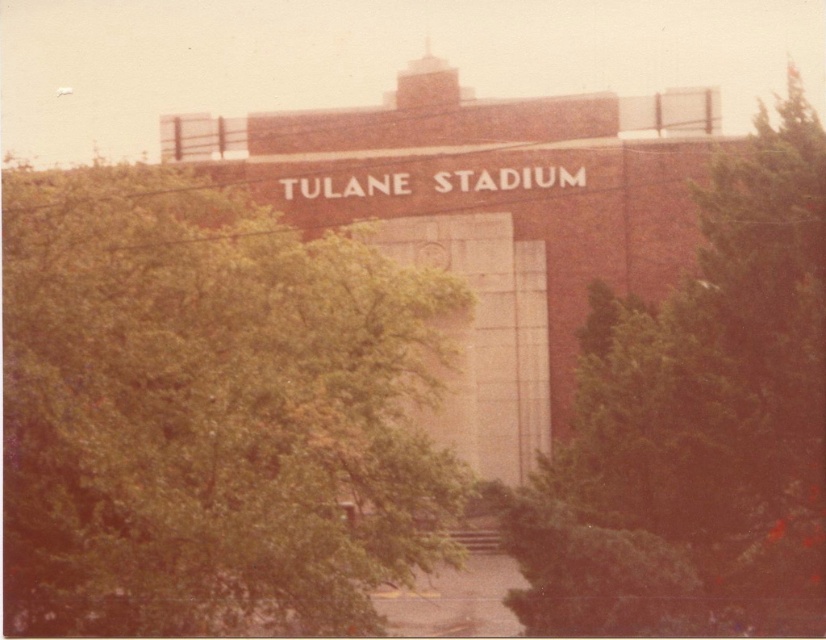
You are standing at the entrance of Tulane Stadium and notice two green leafy trees. Which tree is closer to you, the green leafy tree at center or the green leafy tree at right?

The green leafy tree at center is closer to you because it is in front of the green leafy tree at right.